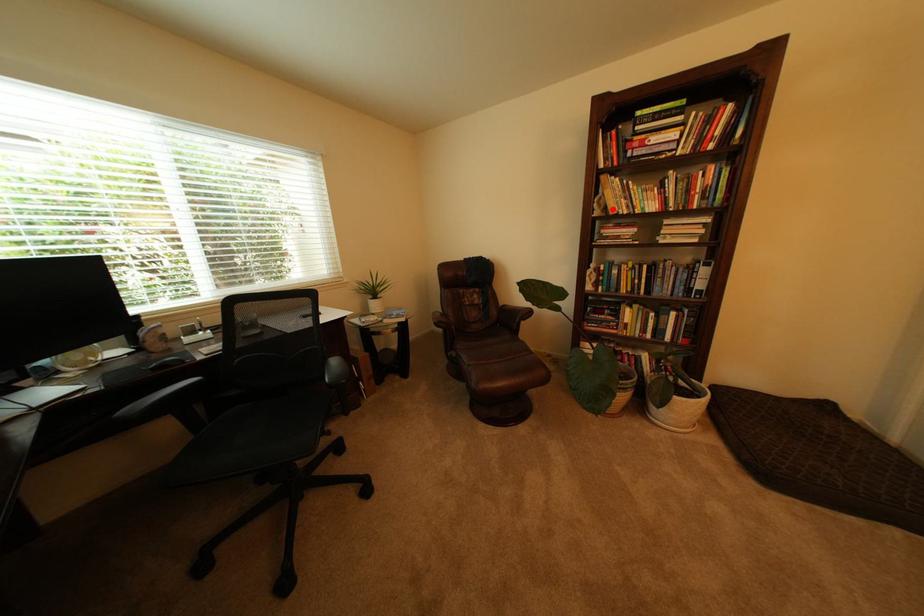
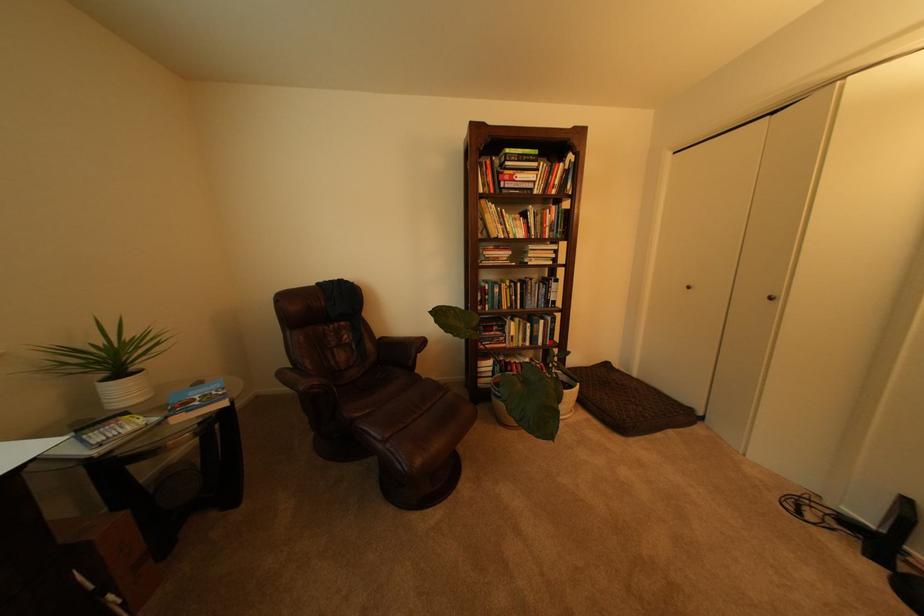
Find the pixel in the second image that matches the highlighted location in the first image.

(492, 232)